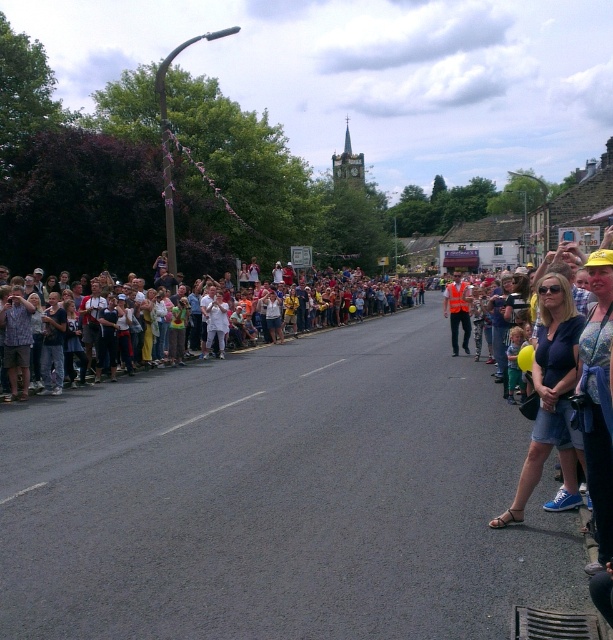
Can you confirm if denim shorts at lower right is shorter than white cotton crowd at left?

Yes.

Who is shorter, denim shorts at lower right or white cotton crowd at left?

denim shorts at lower right is shorter.

Does point (569, 326) lie in front of point (319, 275)?

Yes, point (569, 326) is in front of point (319, 275).

Image resolution: width=613 pixels, height=640 pixels. I want to click on denim shorts at lower right, so click(x=549, y=387).

Does denim shorts at lower right appear on the left side of orange reflective vest at center?

Correct, you'll find denim shorts at lower right to the left of orange reflective vest at center.

How much distance is there between denim shorts at lower right and orange reflective vest at center?

denim shorts at lower right is 46.49 feet away from orange reflective vest at center.

Consider the image. Measure the distance between point (535, 428) and camera.

A distance of 5.77 meters exists between point (535, 428) and camera.

I want to click on denim shorts at lower right, so click(x=549, y=387).

Which is above, white cotton crowd at left or orange reflective vest at center?

Positioned higher is orange reflective vest at center.

Is white cotton crowd at left to the left of orange reflective vest at center from the viewer's perspective?

Correct, you'll find white cotton crowd at left to the left of orange reflective vest at center.

Who is more distant from viewer, (x=402, y=301) or (x=444, y=314)?

Positioned behind is point (x=402, y=301).

You are a GUI agent. You are given a task and a screenshot of the screen. Output one action in this format:
    pyautogui.click(x=<x>, y=<y>)
    Task: Click on the white cotton crowd at left
    The width and height of the screenshot is (613, 640).
    Given the screenshot: What is the action you would take?
    pyautogui.click(x=348, y=304)